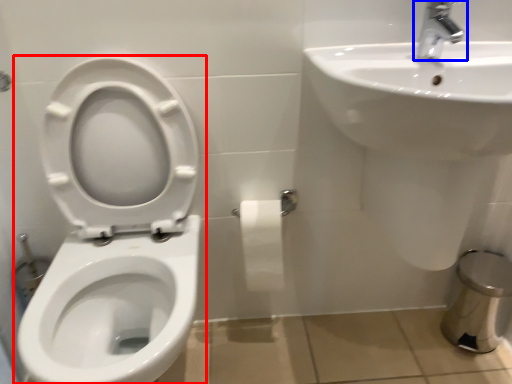
Question: Which object is closer to the camera taking this photo, toilet (highlighted by a red box) or tap (highlighted by a blue box)?

Choices:
 (A) toilet
 (B) tap

Answer: (A)